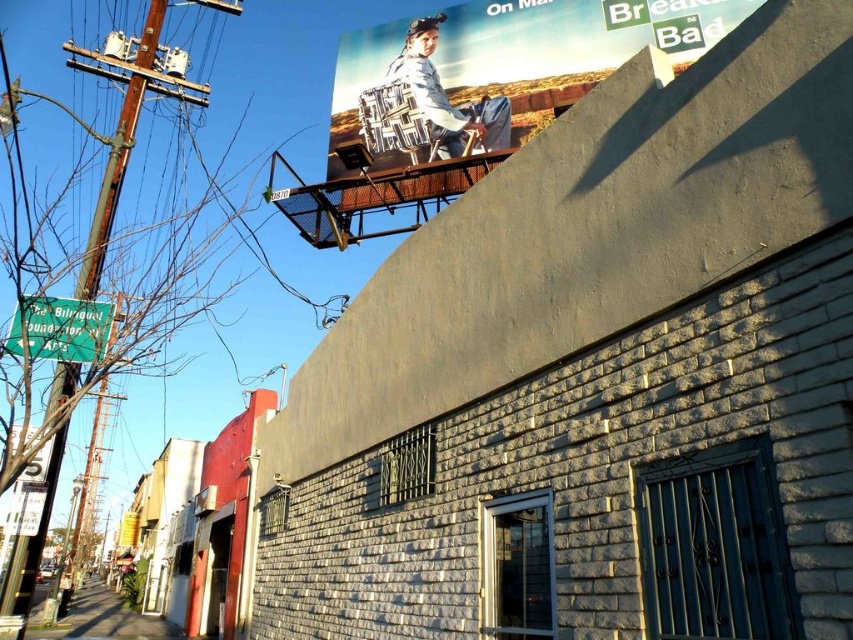
Question: Which point is farther from the camera taking this photo?

Choices:
 (A) (454, 145)
 (B) (99, 316)

Answer: (A)

Question: Does matte plastic billboard at upper center have a lesser width compared to green plastic street sign at left?

Choices:
 (A) yes
 (B) no

Answer: (B)

Question: Among these objects, which one is farthest from the camera?

Choices:
 (A) matte white shirt at upper center
 (B) matte plastic billboard at upper center
 (C) green plastic street sign at left

Answer: (A)

Question: Is matte plastic billboard at upper center bigger than green plastic street sign at left?

Choices:
 (A) yes
 (B) no

Answer: (A)

Question: Which of the following is the closest to the observer?

Choices:
 (A) (498, 44)
 (B) (105, 332)
 (C) (396, 81)

Answer: (B)

Question: Is matte plastic billboard at upper center in front of green plastic street sign at left?

Choices:
 (A) yes
 (B) no

Answer: (B)